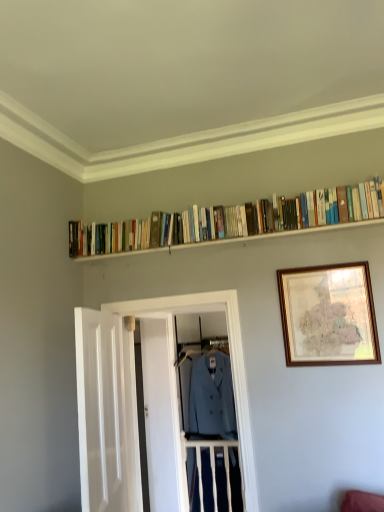
Image resolution: width=384 pixels, height=512 pixels. I want to click on wooden framed map at upper right, so click(x=328, y=315).

Find the location of a particular element. The width and height of the screenshot is (384, 512). hardcover books at upper center is located at coordinates (230, 221).

Find the location of a particular element. wooden framed map at upper right is located at coordinates (328, 315).

From a real-world perspective, is light blue fabric blazer at center above or below hardcover books at upper center?

Clearly, from a real-world perspective, light blue fabric blazer at center is below hardcover books at upper center.

Is light blue fabric blazer at center inside or outside of hardcover books at upper center?

light blue fabric blazer at center is not enclosed by hardcover books at upper center.

Between light blue fabric blazer at center and hardcover books at upper center, which one has larger size?

light blue fabric blazer at center.

From their relative heights in the image, would you say light blue fabric blazer at center is taller or shorter than hardcover books at upper center?

Considering their sizes, light blue fabric blazer at center has more height than hardcover books at upper center.

Is white wooden door at center, the 2th door from the front, not within wooden framed map at upper right?

Yes.

In the scene shown: Can you confirm if white wooden door at center, the 2th door from the front, is bigger than wooden framed map at upper right?

Yes, white wooden door at center, the 2th door from the front, is bigger than wooden framed map at upper right.

Does white wooden door at center, arranged as the first door when viewed from the back, have a lesser height compared to wooden framed map at upper right?

No, white wooden door at center, arranged as the first door when viewed from the back, is not shorter than wooden framed map at upper right.

Between white wooden door at center, arranged as the first door when viewed from the back, and wooden framed map at upper right, which one has larger width?

white wooden door at center, arranged as the first door when viewed from the back, is wider.

Considering the sizes of objects light blue fabric blazer at center and matte blue coat at center in the image provided, who is taller, light blue fabric blazer at center or matte blue coat at center?

matte blue coat at center is taller.

The width and height of the screenshot is (384, 512). I want to click on glass door lying above the light blue fabric blazer at center (from the image's perspective), so click(135, 399).

From a real-world perspective, is light blue fabric blazer at center above or below matte blue coat at center?

light blue fabric blazer at center is situated lower than matte blue coat at center in the real world.

Does point (195, 394) come farther from viewer compared to point (80, 367)?

Yes.

From a real-world perspective, which object stands above the other?

matte blue coat at center is physically above.

At what (x,y) coordinates should I click in order to perform the action: click on door in front of the matte blue coat at center. Please return your answer as a coordinate pair (x, y). The width and height of the screenshot is (384, 512). Looking at the image, I should click on (107, 413).

Can you confirm if matte blue coat at center is smaller than white wooden door at left, the first door when ordered from front to back?

No.

Could you tell me if matte blue coat at center is facing white wooden door at left, positioned as the 2th door in back-to-front order?

Yes.

Where is `door on the right of white wooden door at left, the first door when ordered from front to back`? door on the right of white wooden door at left, the first door when ordered from front to back is located at coordinates (162, 416).

Is white wooden door at left, the first door when ordered from front to back, situated inside white wooden door at center, the 2th door from the front, or outside?

white wooden door at left, the first door when ordered from front to back, lies outside white wooden door at center, the 2th door from the front.

Is white wooden door at left, the first door when ordered from front to back, taller or shorter than white wooden door at center, the 2th door from the front?

In the image, white wooden door at left, the first door when ordered from front to back, appears to be shorter than white wooden door at center, the 2th door from the front.

Considering the relative positions of white wooden door at left, the first door when ordered from front to back, and white wooden door at center, the 2th door from the front, in the image provided, is white wooden door at left, the first door when ordered from front to back, behind white wooden door at center, the 2th door from the front,?

No, white wooden door at left, the first door when ordered from front to back, is in front of white wooden door at center, the 2th door from the front.

Would you say white wooden door at center, the 2th door from the front, is part of matte blue coat at center's contents?

No, white wooden door at center, the 2th door from the front, is not inside matte blue coat at center.

Can you tell me how much matte blue coat at center and white wooden door at center, the 2th door from the front, differ in facing direction?

The angular difference between matte blue coat at center and white wooden door at center, the 2th door from the front, is 90 degrees.

Based on their positions, is matte blue coat at center located to the left or right of white wooden door at center, arranged as the first door when viewed from the back?

matte blue coat at center is positioned on white wooden door at center, arranged as the first door when viewed from the back,'s right side.

From the image's perspective, which one is positioned lower, matte blue coat at center or white wooden door at center, arranged as the first door when viewed from the back?

From the image's view, white wooden door at center, arranged as the first door when viewed from the back, is below.

Is wooden framed map at upper right aimed at matte blue coat at center?

No.

You are a GUI agent. You are given a task and a screenshot of the screen. Output one action in this format:
    pyautogui.click(x=<x>, y=<y>)
    Task: Click on the picture frame on the right of matte blue coat at center
    
    Given the screenshot: What is the action you would take?
    pyautogui.click(x=328, y=315)

Is point (317, 286) closer or farther from the camera than point (124, 352)?

Point (317, 286) appears to be closer to the viewer than point (124, 352).

Is wooden framed map at upper right inside or outside of matte blue coat at center?

The correct answer is: outside.

You are a GUI agent. You are given a task and a screenshot of the screen. Output one action in this format:
    pyautogui.click(x=<x>, y=<y>)
    Task: Click on the clothing located below the hardcover books at upper center (from the image's perspective)
    Image resolution: width=384 pixels, height=512 pixels.
    Given the screenshot: What is the action you would take?
    pyautogui.click(x=212, y=397)

The image size is (384, 512). Find the location of `door that appears behind the wooden framed map at upper right`. door that appears behind the wooden framed map at upper right is located at coordinates (162, 416).

Which object lies further to the anchor point hardcover books at upper center, white wooden door at center, arranged as the first door when viewed from the back, or white wooden door at left, the first door when ordered from front to back?

Based on the image, white wooden door at center, arranged as the first door when viewed from the back, appears to be further to hardcover books at upper center.

Looking at the image, which one is located closer to wooden framed map at upper right, light blue fabric blazer at center or white wooden door at left, the first door when ordered from front to back?

Based on the image, white wooden door at left, the first door when ordered from front to back, appears to be nearer to wooden framed map at upper right.

Estimate the real-world distances between objects in this image. Which object is further from light blue fabric blazer at center, hardcover books at upper center or white wooden door at left, positioned as the 2th door in back-to-front order?

hardcover books at upper center.

Based on their spatial positions, is white wooden door at center, the 2th door from the front, or wooden framed map at upper right further from matte blue coat at center?

white wooden door at center, the 2th door from the front.

Consider the image. From the image, which object appears to be nearer to white wooden door at center, arranged as the first door when viewed from the back, hardcover books at upper center or white wooden door at left, positioned as the 2th door in back-to-front order?

white wooden door at left, positioned as the 2th door in back-to-front order.

From the image, which object appears to be nearer to wooden framed map at upper right, matte blue coat at center or white wooden door at center, arranged as the first door when viewed from the back?

Among the two, matte blue coat at center is located nearer to wooden framed map at upper right.

From the image, which object appears to be nearer to white wooden door at left, positioned as the 2th door in back-to-front order, hardcover books at upper center or wooden framed map at upper right?

hardcover books at upper center is closer to white wooden door at left, positioned as the 2th door in back-to-front order.

Based on their spatial positions, is matte blue coat at center or light blue fabric blazer at center closer to hardcover books at upper center?

Among the two, matte blue coat at center is located nearer to hardcover books at upper center.

The height and width of the screenshot is (512, 384). What are the coordinates of `picture frame between hardcover books at upper center and light blue fabric blazer at center in the front-back direction` in the screenshot? It's located at (328, 315).

In order to click on door between wooden framed map at upper right and light blue fabric blazer at center from front to back in this screenshot , I will do `click(162, 416)`.

Identify the location of glass door positioned between white wooden door at left, positioned as the 2th door in back-to-front order, and white wooden door at center, arranged as the first door when viewed from the back, from near to far. (135, 399).

Where is `door between matte blue coat at center and light blue fabric blazer at center from front to back`? Image resolution: width=384 pixels, height=512 pixels. door between matte blue coat at center and light blue fabric blazer at center from front to back is located at coordinates (162, 416).